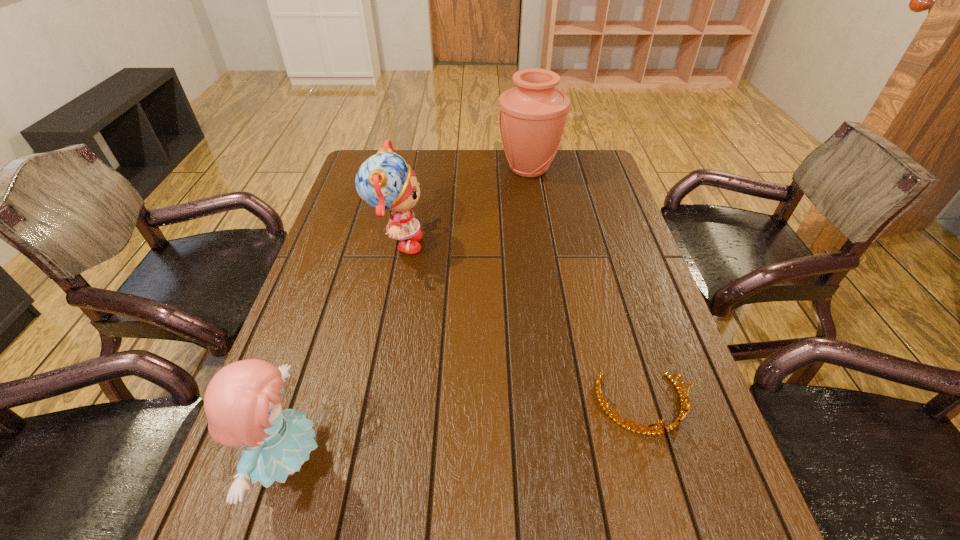
The image size is (960, 540). In order to click on vase that is at the right edge in this screenshot , I will do `click(532, 116)`.

Identify the location of tiara that is at the right edge. This screenshot has width=960, height=540. (648, 430).

This screenshot has height=540, width=960. Find the location of `object at the near left corner`. object at the near left corner is located at coordinates (242, 403).

Find the location of `object that is at the far right corner`. object that is at the far right corner is located at coordinates (532, 116).

Image resolution: width=960 pixels, height=540 pixels. Find the location of `free region at the far edge of the desktop`. free region at the far edge of the desktop is located at coordinates tap(468, 167).

Image resolution: width=960 pixels, height=540 pixels. Identify the location of vacant area at the left edge of the desktop. (322, 251).

You are a GUI agent. You are given a task and a screenshot of the screen. Output one action in this format:
    pyautogui.click(x=<x>, y=<y>)
    Task: Click on the free region at the right edge of the desktop
    The image size is (960, 540).
    Given the screenshot: What is the action you would take?
    pyautogui.click(x=681, y=494)

At what (x,y) coordinates should I click in order to perform the action: click on vacant space at the far left corner of the desktop. Please return your answer as a coordinate pair (x, y). Looking at the image, I should click on (x=402, y=152).

Identify the location of free space at the far right corner. Image resolution: width=960 pixels, height=540 pixels. (600, 156).

The height and width of the screenshot is (540, 960). Identify the location of free space between the second farthest object and the vase. (463, 207).